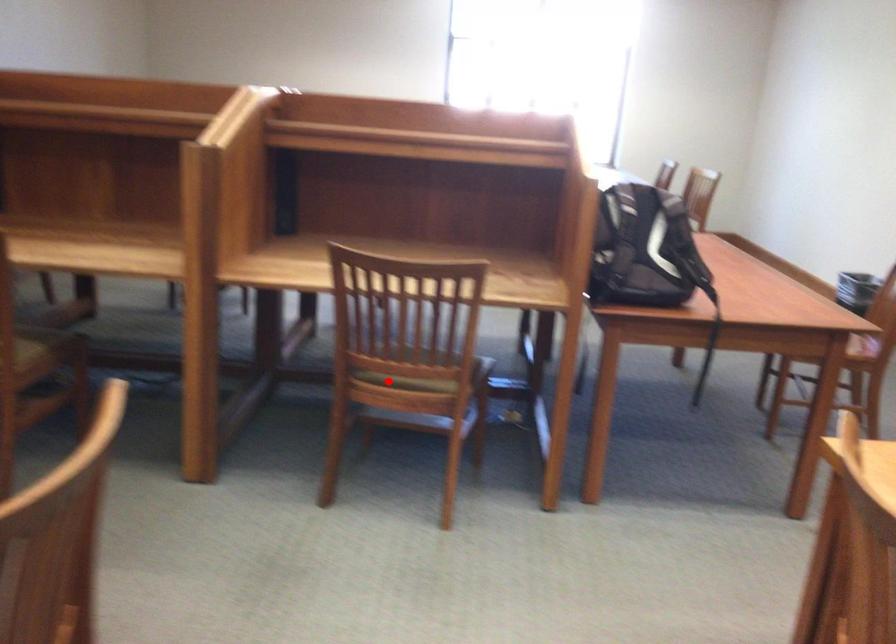
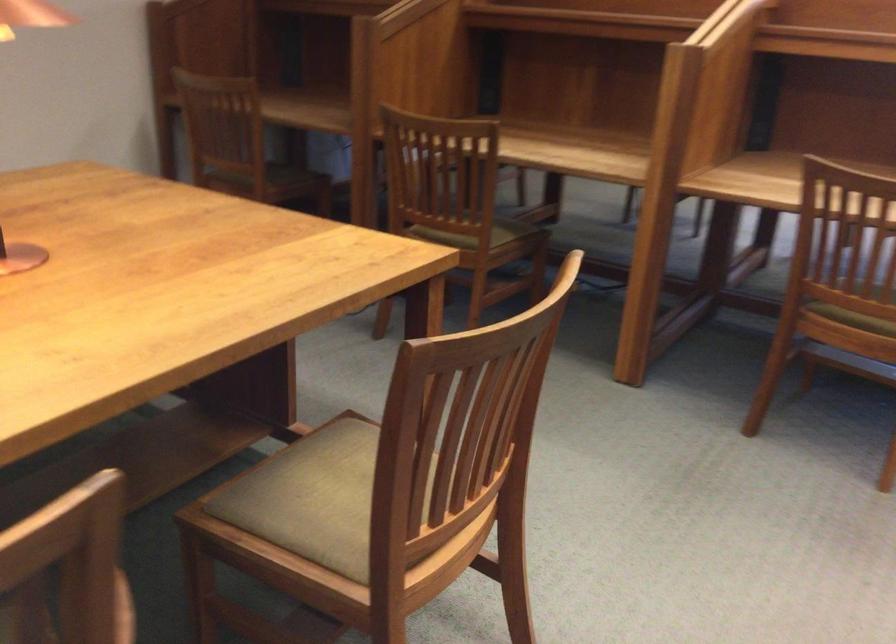
Locate, in the second image, the point that corresponds to the highlighted location in the first image.

(855, 313)